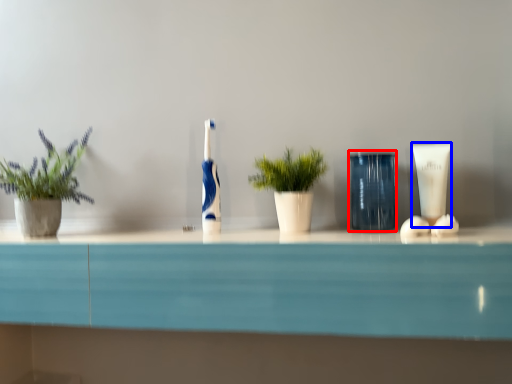
Question: Which point is closer to the camera, glass vase (highlighted by a red box) or toiletry (highlighted by a blue box)?

Choices:
 (A) glass vase
 (B) toiletry

Answer: (A)